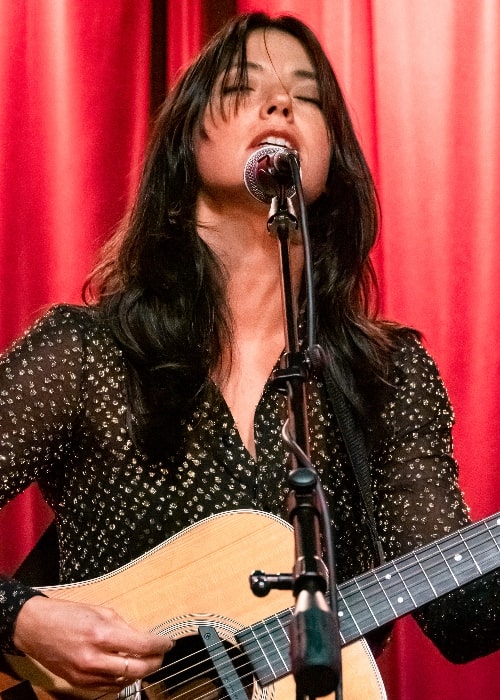
The width and height of the screenshot is (500, 700). Identify the location of curtain. (368, 102).